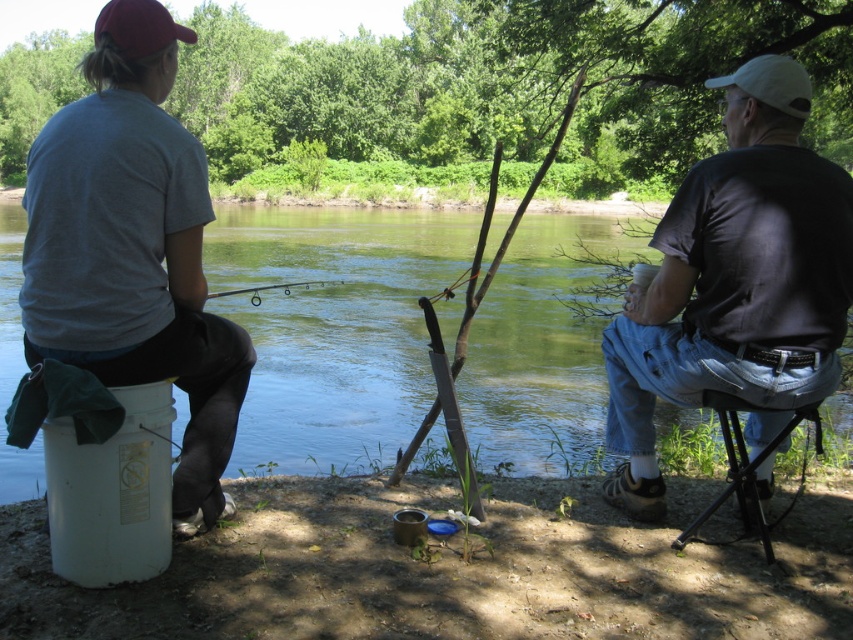
Question: Which object is farther from the camera taking this photo?

Choices:
 (A) matte gray shirt at left
 (B) dark gray t-shirt at right
 (C) green water at center

Answer: (C)

Question: Does matte gray shirt at left have a larger size compared to black plastic stool at lower right?

Choices:
 (A) yes
 (B) no

Answer: (B)

Question: Among these objects, which one is nearest to the camera?

Choices:
 (A) black plastic stool at lower right
 (B) clear plastic rod at center
 (C) matte gray shirt at left

Answer: (C)

Question: Does green water at center appear on the right side of black plastic stool at lower right?

Choices:
 (A) yes
 (B) no

Answer: (B)

Question: Does green water at center have a greater width compared to black plastic stool at lower right?

Choices:
 (A) yes
 (B) no

Answer: (A)

Question: Among these objects, which one is farthest from the camera?

Choices:
 (A) black plastic stool at lower right
 (B) clear plastic rod at center

Answer: (B)